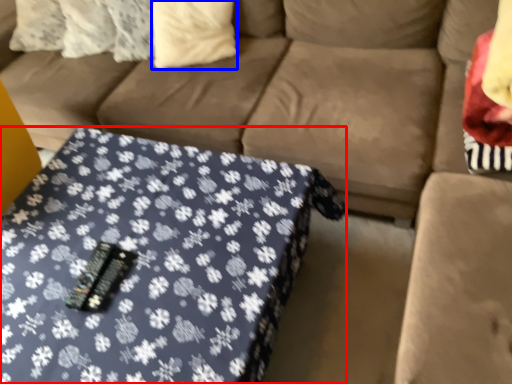
Question: Which point is further to the camera, table (highlighted by a red box) or pillow (highlighted by a blue box)?

Choices:
 (A) table
 (B) pillow

Answer: (B)